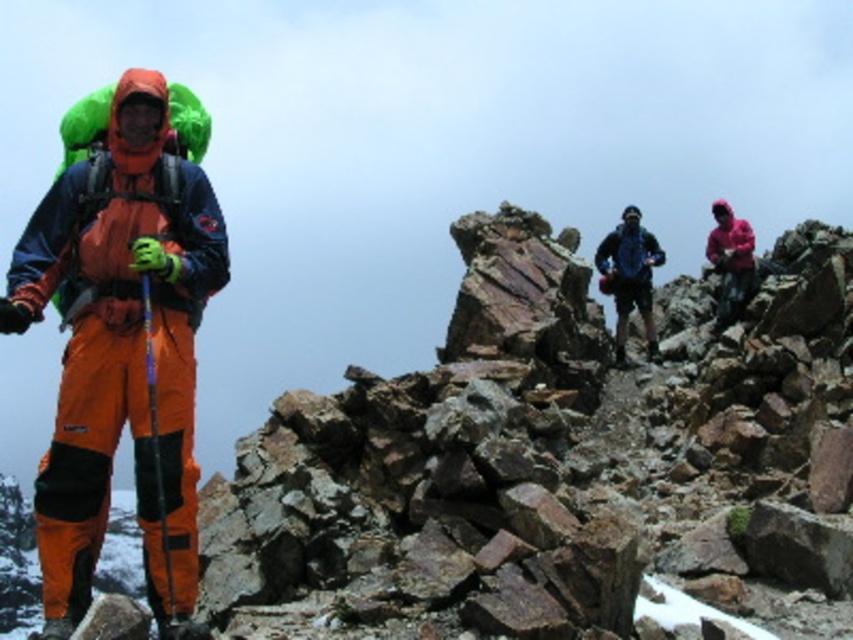
You are a hiker planning to take a photo of the rugged stone mountain at center and the orange softshell jacket at left. Based on their positions, which object should you focus on first to ensure both are in frame?

The rugged stone mountain at center is located below the orange softshell jacket at left, so you should focus on the orange softshell jacket at left first to ensure both are in frame.

Looking at this image, you are a hiker planning to take a photo of the rugged stone mountain at center from the current viewpoint. Given that the mountain is located at coordinates point 0.719, 0.646, would you need to adjust your camera focus to capture it clearly?

The rugged stone mountain at center is positioned at point (550, 460), so you would need to adjust your camera focus to that coordinate to capture it clearly.